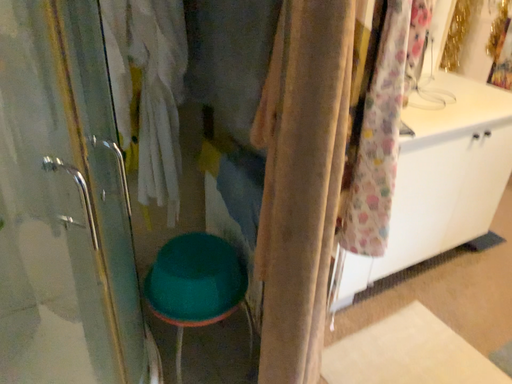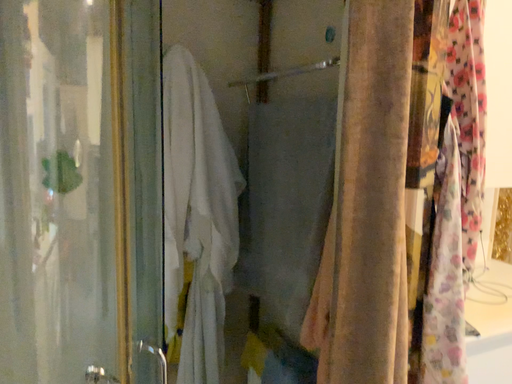
Question: How did the camera likely rotate when shooting the video?

Choices:
 (A) rotated downward
 (B) rotated upward

Answer: (B)